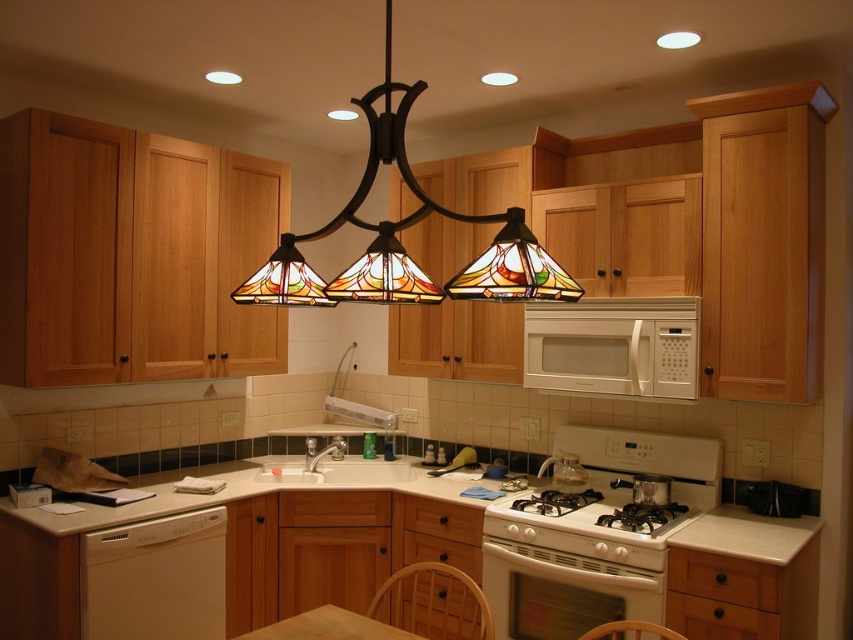
You are a kitchen designer planning to install a new cabinet above the white matte dishwasher at lower left and the white glossy sink at center. Which appliance requires a taller cabinet due to its height?

The white matte dishwasher at lower left requires a taller cabinet because it has a greater height compared to the white glossy sink at center.

You are organizing the kitchen and need to place a new dish rack. You have two options for placement near the white matte dishwasher at lower left and the white glossy sink at center. Which location would be more practical for drying dishes efficiently?

The white glossy sink at center is the more practical location for placing the dish rack since it is closer to the sink where dishes are washed, making it easier to rinse and dry them efficiently.